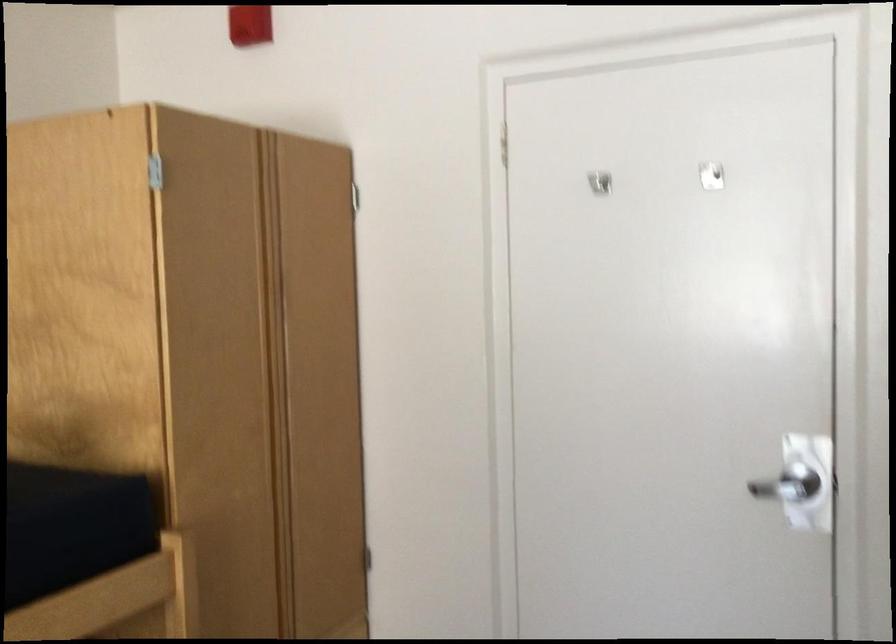
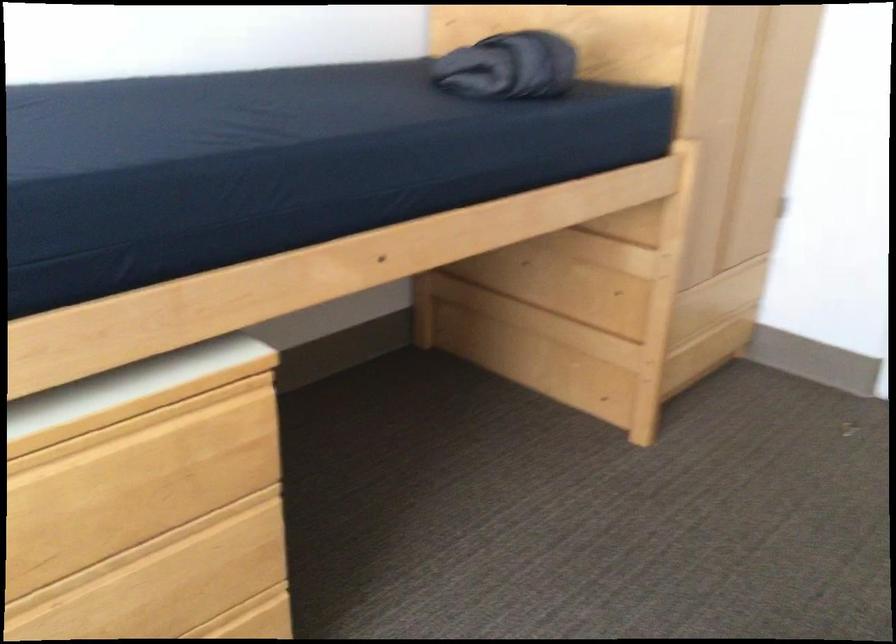
In a continuous first-person perspective shot, in which direction is the camera moving?

The cameraman moved toward left, backward.